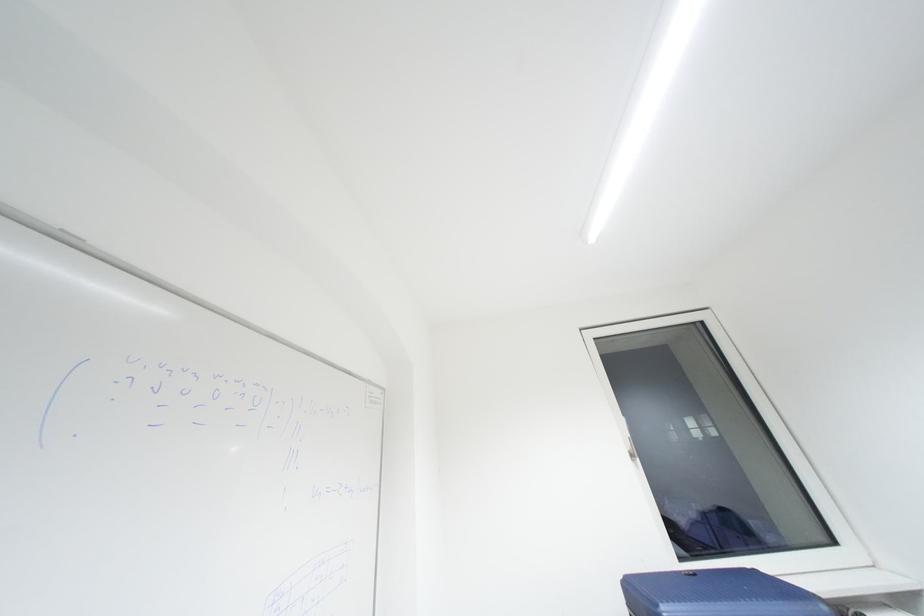
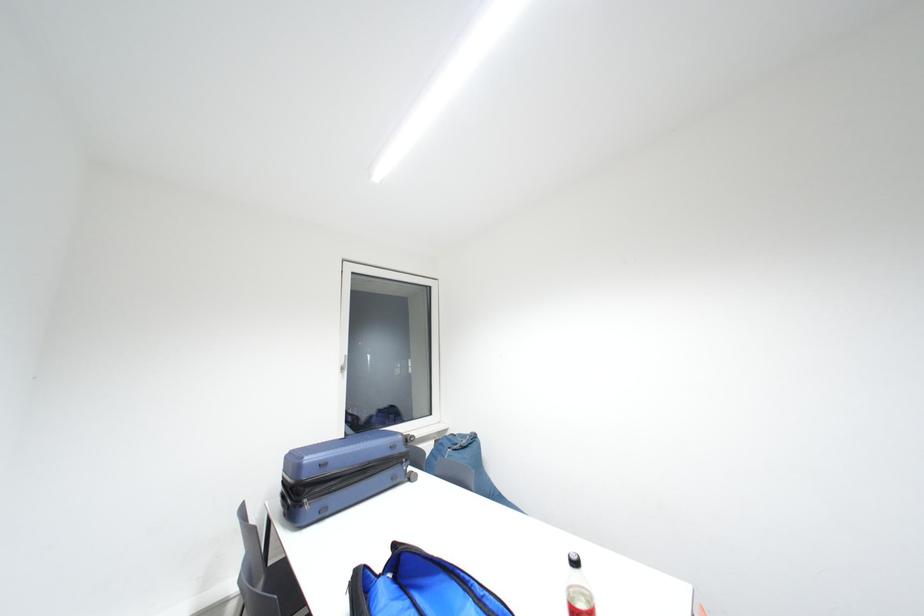
Question: The camera is either moving clockwise (left) or counter-clockwise (right) around the object. The first image is from the beginning of the video and the second image is from the end. Is the camera moving left or right when shooting the video?

Choices:
 (A) Left
 (B) Right

Answer: (A)